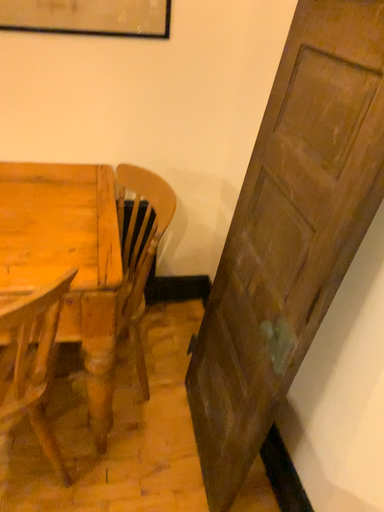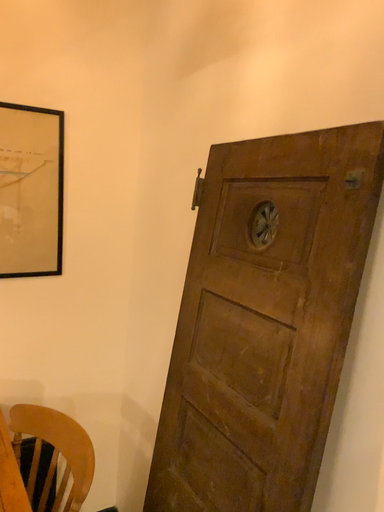
Question: How did the camera likely rotate when shooting the video?

Choices:
 (A) rotated upward
 (B) rotated downward

Answer: (A)